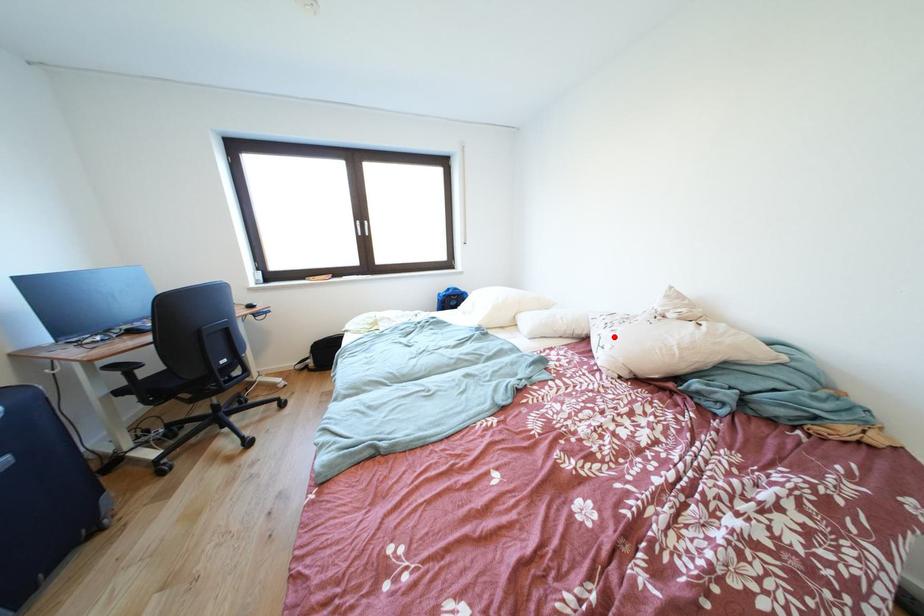
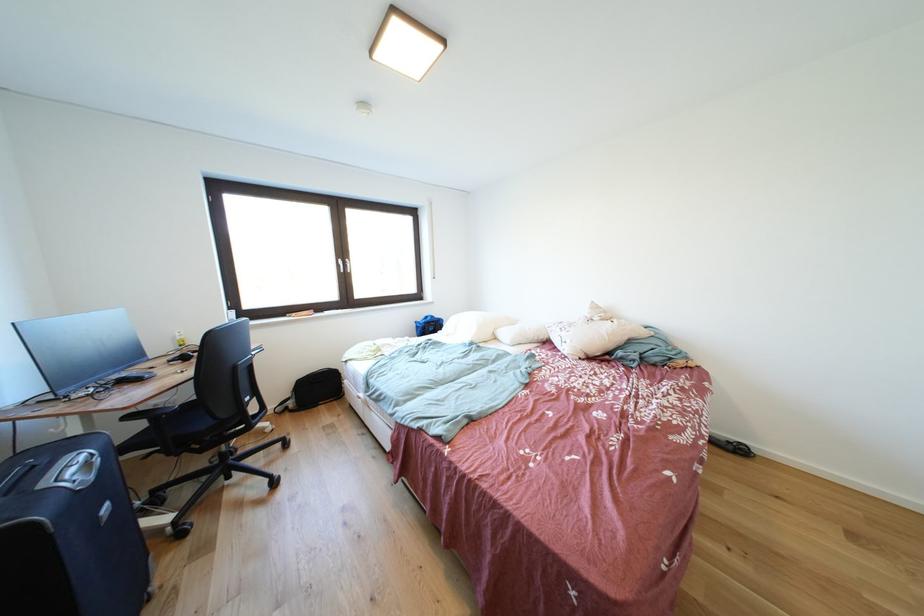
Question: I am providing you with two images of the same scene from different viewpoints. A red point is marked on the first image. Can you still see the location of the red point in image 2?

Choices:
 (A) Yes
 (B) No

Answer: (A)